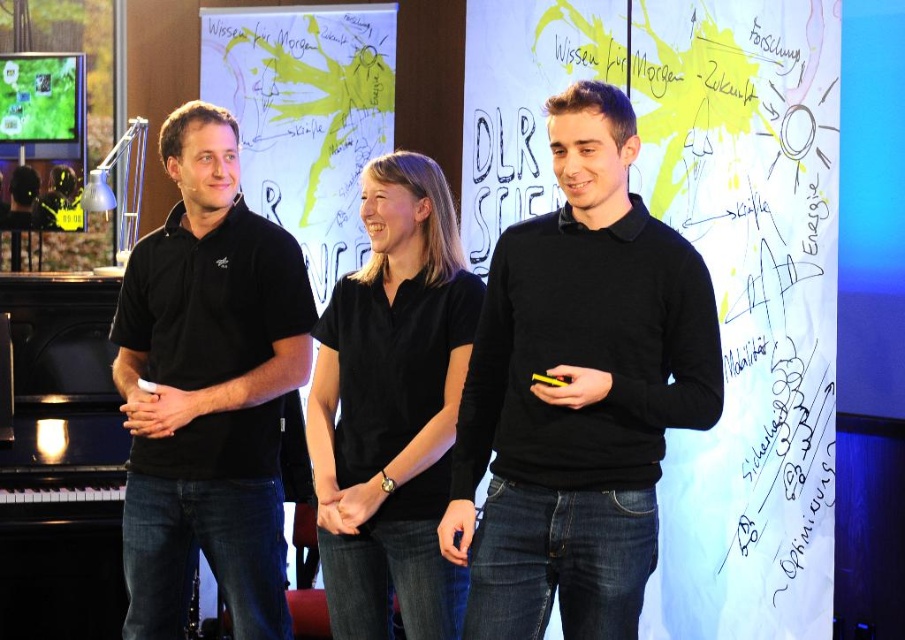
Question: Estimate the real-world distances between objects in this image. Which object is farther from the black matte shirt at left?

Choices:
 (A) black matte shirt at center
 (B) black matte sweater at center

Answer: (B)

Question: Which point appears farthest from the camera in this image?

Choices:
 (A) (236, 579)
 (B) (479, 563)

Answer: (A)

Question: Does black matte sweater at center lie behind black matte shirt at center?

Choices:
 (A) no
 (B) yes

Answer: (A)

Question: Can you confirm if black matte sweater at center is smaller than black matte shirt at left?

Choices:
 (A) no
 (B) yes

Answer: (B)

Question: Is black matte sweater at center below black matte shirt at center?

Choices:
 (A) no
 (B) yes

Answer: (A)

Question: Which point is farther to the camera?

Choices:
 (A) black matte sweater at center
 (B) black matte shirt at left

Answer: (B)